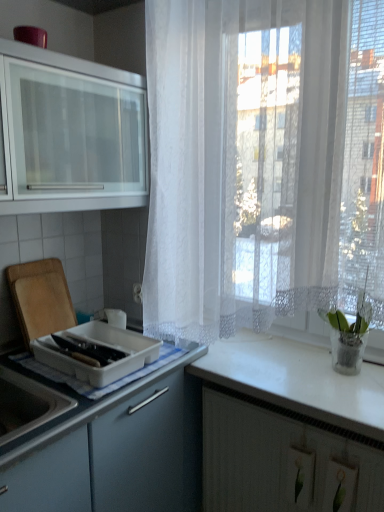
Question: From their relative heights in the image, would you say white lace curtain at right is taller or shorter than white glossy countertop at right?

Choices:
 (A) short
 (B) tall

Answer: (B)

Question: From the image's perspective, is white lace curtain at right located above or below white glossy countertop at right?

Choices:
 (A) below
 (B) above

Answer: (B)

Question: Which of these objects is positioned farthest from the white matte cabinet at lower right, which is the 1th cabinetry in bottom-to-top order?

Choices:
 (A) matte glass cabinet at upper left, marked as the second cabinetry in a right-to-left arrangement
 (B) white glossy countertop at right
 (C) green glass vase at right
 (D) white plastic container at left
 (E) white lace curtain at right

Answer: (A)

Question: Estimate the real-world distances between objects in this image. Which object is farther from the white glossy countertop at right?

Choices:
 (A) matte glass cabinet at upper left, the 2th cabinetry positioned from the bottom
 (B) white lace curtain at right
 (C) white plastic container at left
 (D) green glass vase at right
 (E) white matte cabinet at lower right, which is counted as the 2th cabinetry, starting from the left

Answer: (A)